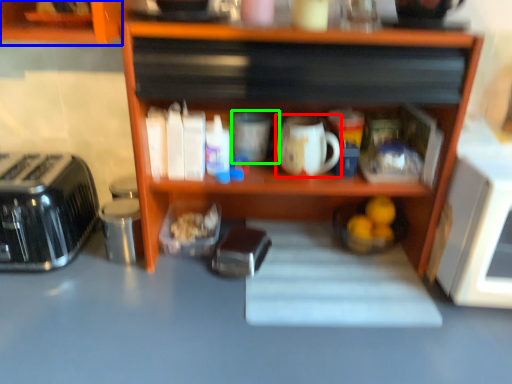
Question: Based on their relative distances, which object is nearer to coffee cup (highlighted by a red box)? Choose from cabinetry (highlighted by a blue box) and mug (highlighted by a green box).

Choices:
 (A) cabinetry
 (B) mug

Answer: (B)